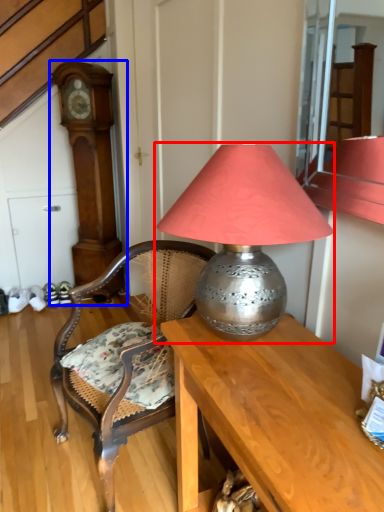
Question: Which object is further to the camera taking this photo, lamp (highlighted by a red box) or clock (highlighted by a blue box)?

Choices:
 (A) lamp
 (B) clock

Answer: (B)